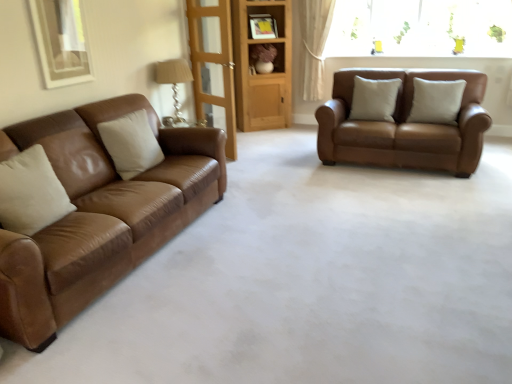
Question: Is wooden bookshelf at center looking in the opposite direction of matte brown leather couch at left, which appears as the first studio couch when viewed from the left?

Choices:
 (A) yes
 (B) no

Answer: (B)

Question: Does wooden bookshelf at center have a greater width compared to matte brown leather couch at left, which is the 2th studio couch from back to front?

Choices:
 (A) no
 (B) yes

Answer: (A)

Question: From a real-world perspective, is wooden bookshelf at center positioned under matte brown leather couch at left, which is the 2th studio couch from back to front, based on gravity?

Choices:
 (A) yes
 (B) no

Answer: (B)

Question: Is there a large distance between wooden bookshelf at center and matte brown leather couch at left, which is the 2th studio couch from back to front?

Choices:
 (A) no
 (B) yes

Answer: (B)

Question: From a real-world perspective, is wooden bookshelf at center over matte brown leather couch at left, which ranks as the first studio couch in front-to-back order?

Choices:
 (A) yes
 (B) no

Answer: (A)

Question: Is wooden bookshelf at center surrounding matte brown leather couch at left, placed as the second studio couch when sorted from right to left?

Choices:
 (A) yes
 (B) no

Answer: (B)

Question: Considering the relative sizes of matte brown shelf at center and beige leather pillow at center, the 1th pillow positioned from the back, in the image provided, is matte brown shelf at center taller than beige leather pillow at center, the 1th pillow positioned from the back,?

Choices:
 (A) no
 (B) yes

Answer: (A)

Question: Is matte brown shelf at center to the right of beige leather pillow at center, positioned as the third pillow in front-to-back order, from the viewer's perspective?

Choices:
 (A) no
 (B) yes

Answer: (A)

Question: Considering the relative sizes of matte brown shelf at center and beige leather pillow at center, the 2th pillow from the right, in the image provided, is matte brown shelf at center wider than beige leather pillow at center, the 2th pillow from the right,?

Choices:
 (A) no
 (B) yes

Answer: (B)

Question: Can beige leather pillow at center, the 1th pillow positioned from the back, be found inside matte brown shelf at center?

Choices:
 (A) no
 (B) yes

Answer: (A)

Question: From a real-world perspective, is matte brown shelf at center under beige leather pillow at center, the 2th pillow positioned from the left?

Choices:
 (A) no
 (B) yes

Answer: (A)

Question: Is matte brown shelf at center not near beige leather pillow at center, the 2th pillow positioned from the left?

Choices:
 (A) no
 (B) yes

Answer: (B)

Question: Does white leather pillow at center, acting as the first pillow starting from the right, have a smaller size compared to white leather pillow at left, which is counted as the first pillow, starting from the left?

Choices:
 (A) yes
 (B) no

Answer: (B)